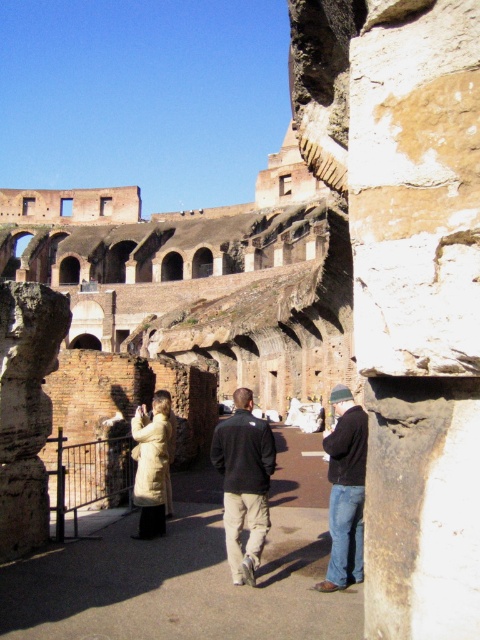
You are a tour guide at the Colosseum ruins. You notice two visitors wearing a dark gray fleece jacket at center and a beige wool coat at center. Which visitor is standing closer to you?

The dark gray fleece jacket at center is positioned over beige wool coat at center, so the visitor wearing the dark gray fleece jacket at center is closer to you.

You are standing at the entrance of the ruins and want to locate the dark gray fleece jacket at center. According to the coordinates provided, where would you find it?

The dark gray fleece jacket at center is located at coordinates point (243, 483).